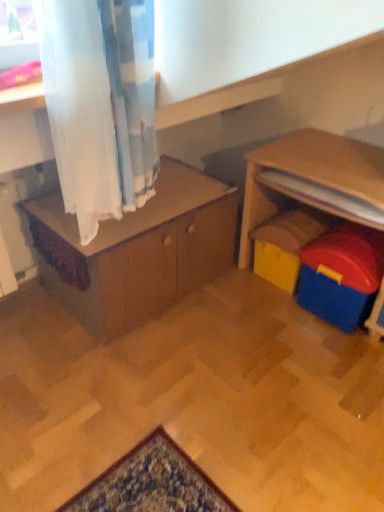
Question: Is yellow plastic toy at lower right, which appears as the 1th toy when viewed from the back, at the left side of wooden cabinet at center?

Choices:
 (A) no
 (B) yes

Answer: (A)

Question: From a real-world perspective, is yellow plastic toy at lower right, which appears as the 1th toy when viewed from the back, over wooden cabinet at center?

Choices:
 (A) no
 (B) yes

Answer: (A)

Question: Considering the relative sizes of yellow plastic toy at lower right, which appears as the 1th toy when viewed from the back, and wooden cabinet at center in the image provided, is yellow plastic toy at lower right, which appears as the 1th toy when viewed from the back, shorter than wooden cabinet at center?

Choices:
 (A) no
 (B) yes

Answer: (B)

Question: From a real-world perspective, is yellow plastic toy at lower right, the second toy in the front-to-back sequence, under wooden cabinet at center?

Choices:
 (A) no
 (B) yes

Answer: (B)

Question: Is yellow plastic toy at lower right, the second toy in the front-to-back sequence, taller or shorter than blue plastic toy at right, the second toy when ordered from back to front?

Choices:
 (A) short
 (B) tall

Answer: (A)

Question: Based on their positions, is yellow plastic toy at lower right, the second toy in the front-to-back sequence, located to the left or right of blue plastic toy at right, which ranks as the 1th toy in front-to-back order?

Choices:
 (A) left
 (B) right

Answer: (A)

Question: Is yellow plastic toy at lower right, which appears as the 1th toy when viewed from the back, wider or thinner than blue plastic toy at right, the second toy when ordered from back to front?

Choices:
 (A) thin
 (B) wide

Answer: (B)

Question: From a real-world perspective, is yellow plastic toy at lower right, the second toy in the front-to-back sequence, physically located above or below blue plastic toy at right, the second toy when ordered from back to front?

Choices:
 (A) above
 (B) below

Answer: (B)

Question: In the image, is yellow plastic toy at lower right, which appears as the 1th toy when viewed from the back, positioned in front of or behind wooden cabinet at center?

Choices:
 (A) behind
 (B) front

Answer: (A)

Question: From a real-world perspective, is yellow plastic toy at lower right, which appears as the 1th toy when viewed from the back, physically located above or below wooden cabinet at center?

Choices:
 (A) below
 (B) above

Answer: (A)

Question: In terms of width, does yellow plastic toy at lower right, which appears as the 1th toy when viewed from the back, look wider or thinner when compared to wooden cabinet at center?

Choices:
 (A) wide
 (B) thin

Answer: (B)

Question: Does point (297, 272) appear closer or farther from the camera than point (231, 224)?

Choices:
 (A) closer
 (B) farther

Answer: (A)

Question: Do you think wooden cabinet at center is within yellow plastic toy at lower right, the second toy in the front-to-back sequence, or outside of it?

Choices:
 (A) inside
 (B) outside

Answer: (B)

Question: From a real-world perspective, is wooden cabinet at center physically located above or below yellow plastic toy at lower right, which appears as the 1th toy when viewed from the back?

Choices:
 (A) below
 (B) above

Answer: (B)